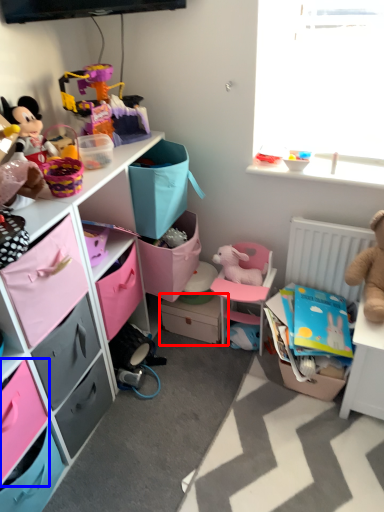
Question: Which of the following is the farthest to the observer, storage box (highlighted by a red box) or drawer (highlighted by a blue box)?

Choices:
 (A) storage box
 (B) drawer

Answer: (A)